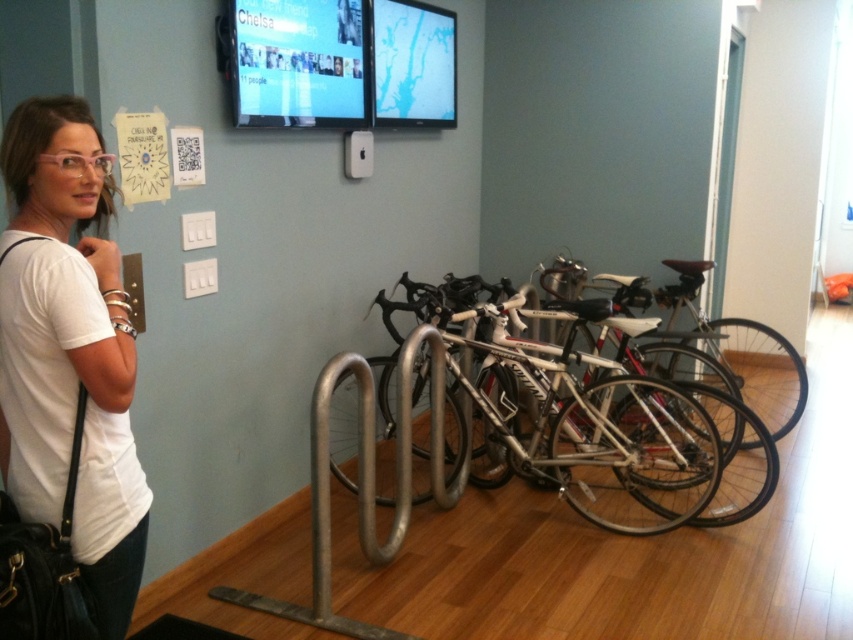
Question: Can you confirm if silver metallic bicycle at center is thinner than white matte t-shirt at left?

Choices:
 (A) yes
 (B) no

Answer: (B)

Question: Which object appears closest to the camera in this image?

Choices:
 (A) silver metallic bicycle at center
 (B) white matte t-shirt at left

Answer: (B)

Question: Is silver metallic bicycle at center further to camera compared to white matte t-shirt at left?

Choices:
 (A) yes
 (B) no

Answer: (A)

Question: Does silver metallic bicycle at center lie in front of white matte t-shirt at left?

Choices:
 (A) yes
 (B) no

Answer: (B)

Question: Which object is farther from the camera taking this photo?

Choices:
 (A) silver metallic bicycle at center
 (B) white matte t-shirt at left

Answer: (A)